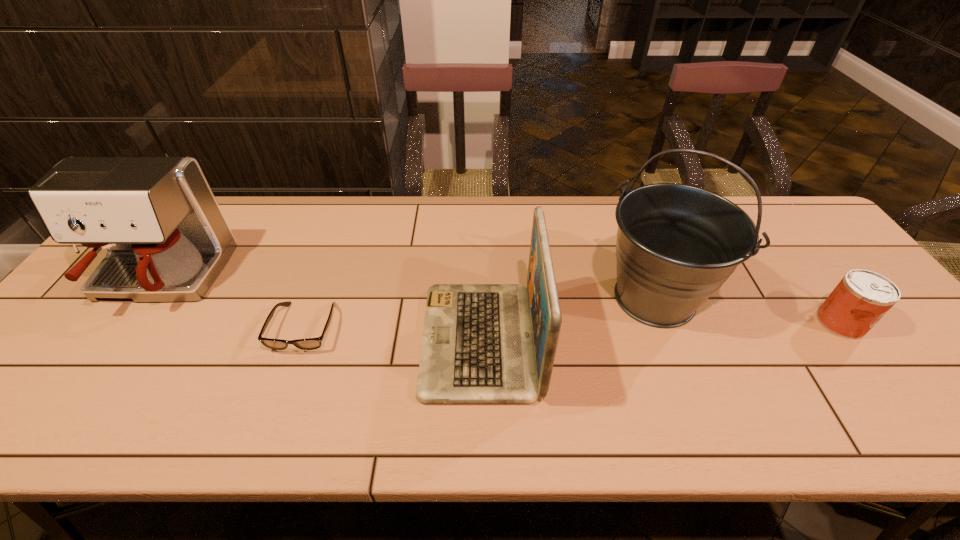
Identify which object is the third closest to the fourth tallest object. Please provide its 2D coordinates. Your answer should be formatted as a tuple, i.e. [(x, y)], where the tuple contains the x and y coordinates of a point satisfying the conditions above.

[(310, 343)]

Find the location of a particular element. object that stands as the fourth closest to the third object from left to right is located at coordinates (862, 297).

This screenshot has width=960, height=540. I want to click on free point that satisfies the following two spatial constraints: 1. on the front of the tallest object near the spout; 2. on the left side of the leftmost object, so click(x=146, y=298).

The width and height of the screenshot is (960, 540). Find the location of `blank area in the image that satisfies the following two spatial constraints: 1. on the front of the leftmost object near the spout; 2. on the left side of the second shortest object`. blank area in the image that satisfies the following two spatial constraints: 1. on the front of the leftmost object near the spout; 2. on the left side of the second shortest object is located at coordinates (128, 322).

Identify the location of vacant region that satisfies the following two spatial constraints: 1. on the front of the leftmost object near the spout; 2. on the left side of the second shortest object. (128, 322).

Where is `vacant area in the image that satisfies the following two spatial constraints: 1. on the front of the tallest object near the spout; 2. on the right side of the leftmost object`? The image size is (960, 540). vacant area in the image that satisfies the following two spatial constraints: 1. on the front of the tallest object near the spout; 2. on the right side of the leftmost object is located at coordinates (146, 298).

At what (x,y) coordinates should I click in order to perform the action: click on free spot that satisfies the following two spatial constraints: 1. on the front of the leftmost object near the spout; 2. on the right side of the tallest object. Please return your answer as a coordinate pair (x, y). Looking at the image, I should click on (146, 298).